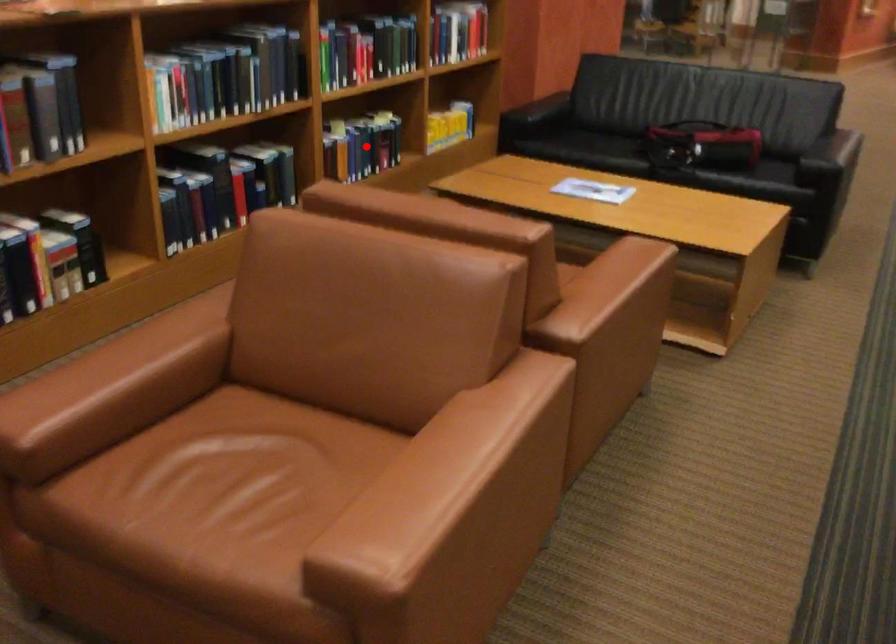
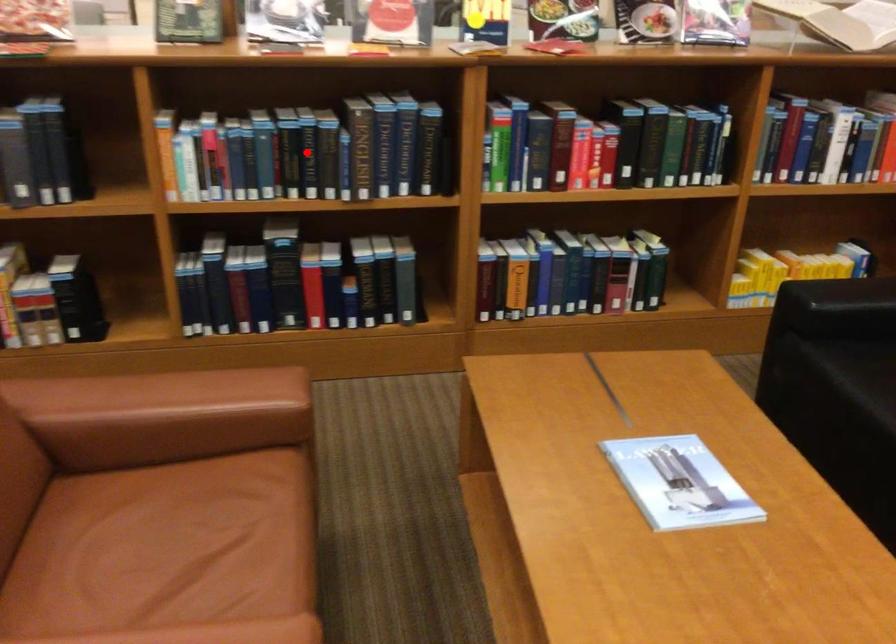
I am providing you with two images of the same scene from different viewpoints. A red point is marked on the first image and another point is marked on the second image. Is the marked point in image1 the same physical position as the marked point in image2?

No